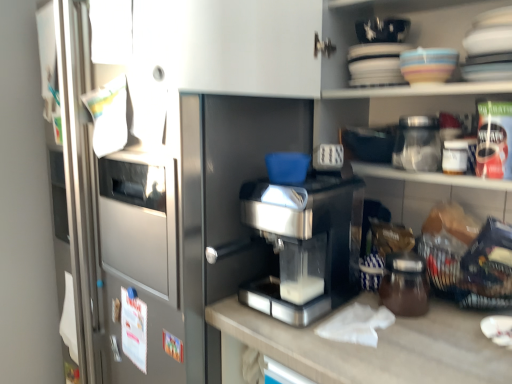
The image size is (512, 384). Identify the location of transparent glass jar at upper right, placed as the second glass jar when sorted from bottom to top. (417, 144).

Find the location of a particular element. The width and height of the screenshot is (512, 384). sleek metallic coffee machine at center is located at coordinates (306, 243).

What is the approximate height of sleek metallic coffee machine at center?

31.46 centimeters.

At what (x,y) coordinates should I click in order to perform the action: click on brown glass jar at lower right, the second glass jar when ordered from top to bottom. Please return your answer as a coordinate pair (x, y). The height and width of the screenshot is (384, 512). Looking at the image, I should click on (405, 284).

Is brown glass jar at lower right, the second glass jar when ordered from top to bottom, closer to the viewer compared to sleek metallic coffee machine at center?

No, the depth of brown glass jar at lower right, the second glass jar when ordered from top to bottom, is greater than that of sleek metallic coffee machine at center.

In terms of height, does brown glass jar at lower right, which is counted as the 1th glass jar, starting from the bottom, look taller or shorter compared to sleek metallic coffee machine at center?

Clearly, brown glass jar at lower right, which is counted as the 1th glass jar, starting from the bottom, is shorter compared to sleek metallic coffee machine at center.

Which is behind, point (412, 257) or point (250, 221)?

Point (412, 257)

From a real-world perspective, is sleek metallic coffee machine at center physically above brown glass jar at lower right, the second glass jar when ordered from top to bottom?

Correct, in the physical world, sleek metallic coffee machine at center is higher than brown glass jar at lower right, the second glass jar when ordered from top to bottom.

Who is smaller, sleek metallic coffee machine at center or brown glass jar at lower right, which is counted as the 1th glass jar, starting from the bottom?

brown glass jar at lower right, which is counted as the 1th glass jar, starting from the bottom, is smaller.

What are the coordinates of `home appliance above the brown glass jar at lower right, the second glass jar when ordered from top to bottom (from the image's perspective)` in the screenshot? It's located at (306, 243).

Consider the image. Which object is wider, sleek metallic coffee machine at center or brown glass jar at lower right, which is counted as the 1th glass jar, starting from the bottom?

sleek metallic coffee machine at center.

Considering the points (389, 255) and (453, 50), which point is behind, point (389, 255) or point (453, 50)?

The point (389, 255) is behind.

Which object is wider, brown glass jar at lower right, which is counted as the 1th glass jar, starting from the bottom, or matte ceramic bowl at upper right?

brown glass jar at lower right, which is counted as the 1th glass jar, starting from the bottom, is wider.

Is brown glass jar at lower right, the second glass jar when ordered from top to bottom, bigger than matte ceramic bowl at upper right?

Indeed, brown glass jar at lower right, the second glass jar when ordered from top to bottom, has a larger size compared to matte ceramic bowl at upper right.

Is brown glass jar at lower right, which is counted as the 1th glass jar, starting from the bottom, taller than matte ceramic bowl at upper right?

Yes, brown glass jar at lower right, which is counted as the 1th glass jar, starting from the bottom, is taller than matte ceramic bowl at upper right.

Is sleek metallic coffee machine at center positioned before transparent glass jar at upper right, which is counted as the first glass jar, starting from the top?

Yes, sleek metallic coffee machine at center is closer to the camera.

Are sleek metallic coffee machine at center and transparent glass jar at upper right, placed as the second glass jar when sorted from bottom to top, beside each other?

sleek metallic coffee machine at center is not next to transparent glass jar at upper right, placed as the second glass jar when sorted from bottom to top, and they're not touching.

From a real-world perspective, between sleek metallic coffee machine at center and transparent glass jar at upper right, placed as the second glass jar when sorted from bottom to top, who is vertically higher?

transparent glass jar at upper right, placed as the second glass jar when sorted from bottom to top.

Based on the photo, from the image's perspective, which object appears higher, sleek metallic coffee machine at center or transparent glass jar at upper right, which is counted as the first glass jar, starting from the top?

transparent glass jar at upper right, which is counted as the first glass jar, starting from the top, appears higher in the image.

Who is taller, brown glass jar at lower right, which is counted as the 1th glass jar, starting from the bottom, or transparent glass jar at upper right, placed as the second glass jar when sorted from bottom to top?

Standing taller between the two is transparent glass jar at upper right, placed as the second glass jar when sorted from bottom to top.

Can you confirm if brown glass jar at lower right, which is counted as the 1th glass jar, starting from the bottom, is bigger than transparent glass jar at upper right, placed as the second glass jar when sorted from bottom to top?

Yes.

I want to click on glass jar behind the brown glass jar at lower right, the second glass jar when ordered from top to bottom, so click(417, 144).

Is transparent glass jar at upper right, placed as the second glass jar when sorted from bottom to top, thinner than sleek metallic coffee machine at center?

Yes, transparent glass jar at upper right, placed as the second glass jar when sorted from bottom to top, is thinner than sleek metallic coffee machine at center.

Is transparent glass jar at upper right, which is counted as the first glass jar, starting from the top, positioned with its back to sleek metallic coffee machine at center?

No.

Which of these two, transparent glass jar at upper right, which is counted as the first glass jar, starting from the top, or sleek metallic coffee machine at center, is bigger?

With larger size is sleek metallic coffee machine at center.

Is point (423, 159) farther from viewer compared to point (289, 215)?

That is True.

From the image's perspective, which is below, sleek metallic coffee machine at center or matte ceramic bowl at upper right?

sleek metallic coffee machine at center appears lower in the image.

Is sleek metallic coffee machine at center looking in the opposite direction of matte ceramic bowl at upper right?

That's not correct — sleek metallic coffee machine at center is not looking away from matte ceramic bowl at upper right.

Consider the image. From a real-world perspective, who is located higher, sleek metallic coffee machine at center or matte ceramic bowl at upper right?

matte ceramic bowl at upper right, from a real-world perspective.

This screenshot has height=384, width=512. Find the location of `glass jar below the sleek metallic coffee machine at center (from a real-world perspective)`. glass jar below the sleek metallic coffee machine at center (from a real-world perspective) is located at coordinates (405, 284).

Where is `glass jar below the sleek metallic coffee machine at center (from the image's perspective)`? This screenshot has height=384, width=512. glass jar below the sleek metallic coffee machine at center (from the image's perspective) is located at coordinates coord(405,284).

Which object lies nearer to the anchor point transparent glass jar at upper right, placed as the second glass jar when sorted from bottom to top, matte ceramic bowl at upper right or sleek metallic coffee machine at center?

matte ceramic bowl at upper right.

Estimate the real-world distances between objects in this image. Which object is closer to transparent glass jar at upper right, placed as the second glass jar when sorted from bottom to top, brown glass jar at lower right, the second glass jar when ordered from top to bottom, or sleek metallic coffee machine at center?

Among the two, brown glass jar at lower right, the second glass jar when ordered from top to bottom, is located nearer to transparent glass jar at upper right, placed as the second glass jar when sorted from bottom to top.

From the image, which object appears to be farther from transparent glass jar at upper right, placed as the second glass jar when sorted from bottom to top, brown glass jar at lower right, the second glass jar when ordered from top to bottom, or matte ceramic bowl at upper right?

Among the two, brown glass jar at lower right, the second glass jar when ordered from top to bottom, is located further to transparent glass jar at upper right, placed as the second glass jar when sorted from bottom to top.

From the image, which object appears to be nearer to matte ceramic bowl at upper right, brown glass jar at lower right, the second glass jar when ordered from top to bottom, or sleek metallic coffee machine at center?

Based on the image, sleek metallic coffee machine at center appears to be nearer to matte ceramic bowl at upper right.

Considering their positions, is transparent glass jar at upper right, which is counted as the first glass jar, starting from the top, positioned further to sleek metallic coffee machine at center than brown glass jar at lower right, the second glass jar when ordered from top to bottom?

The object further to sleek metallic coffee machine at center is transparent glass jar at upper right, which is counted as the first glass jar, starting from the top.

Consider the image. From the image, which object appears to be nearer to sleek metallic coffee machine at center, matte ceramic bowl at upper right or transparent glass jar at upper right, which is counted as the first glass jar, starting from the top?

Based on the image, transparent glass jar at upper right, which is counted as the first glass jar, starting from the top, appears to be nearer to sleek metallic coffee machine at center.

When comparing their distances from brown glass jar at lower right, the second glass jar when ordered from top to bottom, does sleek metallic coffee machine at center or transparent glass jar at upper right, which is counted as the first glass jar, starting from the top, seem further?

transparent glass jar at upper right, which is counted as the first glass jar, starting from the top.

Considering their positions, is sleek metallic coffee machine at center positioned closer to transparent glass jar at upper right, which is counted as the first glass jar, starting from the top, than brown glass jar at lower right, which is counted as the 1th glass jar, starting from the bottom?

Based on the image, brown glass jar at lower right, which is counted as the 1th glass jar, starting from the bottom, appears to be nearer to transparent glass jar at upper right, which is counted as the first glass jar, starting from the top.

At what (x,y) coordinates should I click in order to perform the action: click on glass jar between matte ceramic bowl at upper right and sleek metallic coffee machine at center in the up-down direction. Please return your answer as a coordinate pair (x, y). The width and height of the screenshot is (512, 384). Looking at the image, I should click on (417, 144).

At what (x,y) coordinates should I click in order to perform the action: click on home appliance that lies between matte ceramic bowl at upper right and brown glass jar at lower right, the second glass jar when ordered from top to bottom, from top to bottom. Please return your answer as a coordinate pair (x, y). The width and height of the screenshot is (512, 384). Looking at the image, I should click on (306, 243).

At what (x,y) coordinates should I click in order to perform the action: click on glass jar located between sleek metallic coffee machine at center and transparent glass jar at upper right, placed as the second glass jar when sorted from bottom to top, in the left-right direction. Please return your answer as a coordinate pair (x, y). Looking at the image, I should click on (405, 284).

The image size is (512, 384). Find the location of `glass jar between matte ceramic bowl at upper right and brown glass jar at lower right, which is counted as the 1th glass jar, starting from the bottom, vertically`. glass jar between matte ceramic bowl at upper right and brown glass jar at lower right, which is counted as the 1th glass jar, starting from the bottom, vertically is located at coordinates (417, 144).